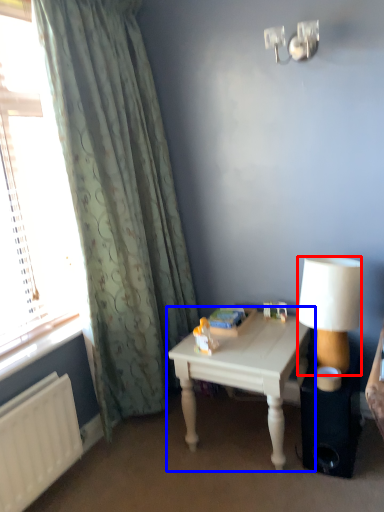
Question: Among these objects, which one is farthest to the camera, lamp (highlighted by a red box) or table (highlighted by a blue box)?

Choices:
 (A) lamp
 (B) table

Answer: (B)